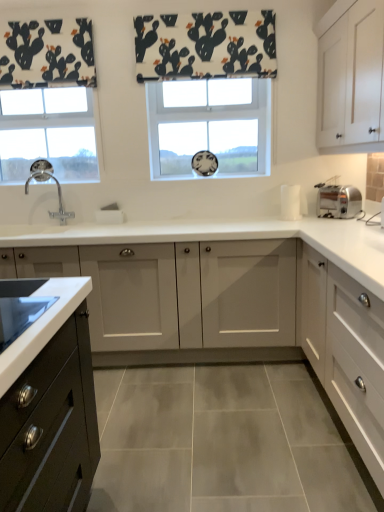
The image size is (384, 512). Identify the location of free point above white fabric with cactus print at upper center (from a real-world perspective). (209, 4).